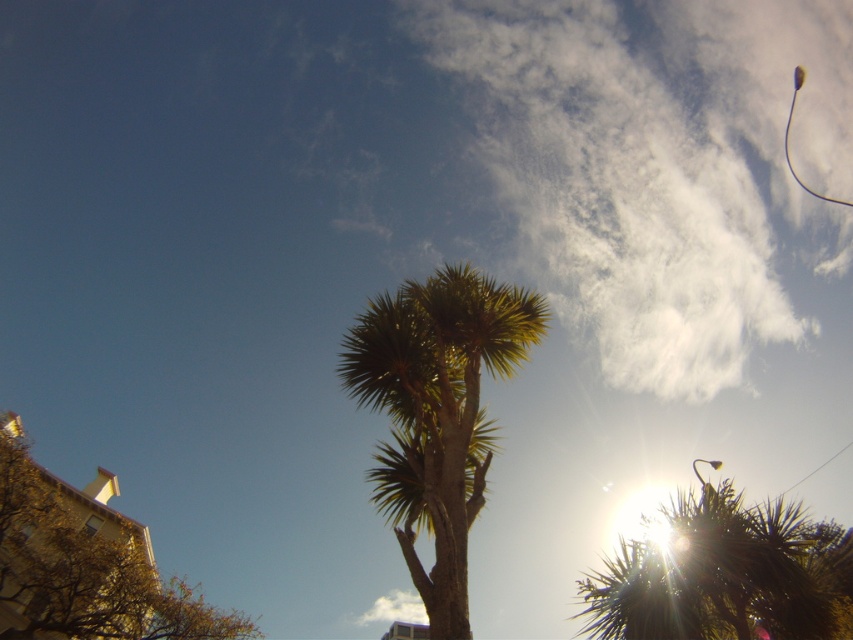
Question: Which of the following is the farthest from the observer?

Choices:
 (A) (419, 323)
 (B) (74, 536)
 (C) (697, 4)

Answer: (C)

Question: Which of the following is the farthest from the observer?

Choices:
 (A) green spiky tree at center
 (B) white fluffy cloud at upper center
 (C) brown textured tree at lower left

Answer: (B)

Question: Is green leafy palm tree at center bigger than brown textured tree at lower left?

Choices:
 (A) no
 (B) yes

Answer: (A)

Question: Which object is farther from the camera taking this photo?

Choices:
 (A) brown textured tree at lower left
 (B) green spiky tree at center

Answer: (A)

Question: Can you confirm if white fluffy cloud at upper center is positioned below green leafy palm tree at center?

Choices:
 (A) no
 (B) yes

Answer: (A)

Question: Does white fluffy cloud at upper center have a greater width compared to green leafy palm tree at center?

Choices:
 (A) no
 (B) yes

Answer: (B)